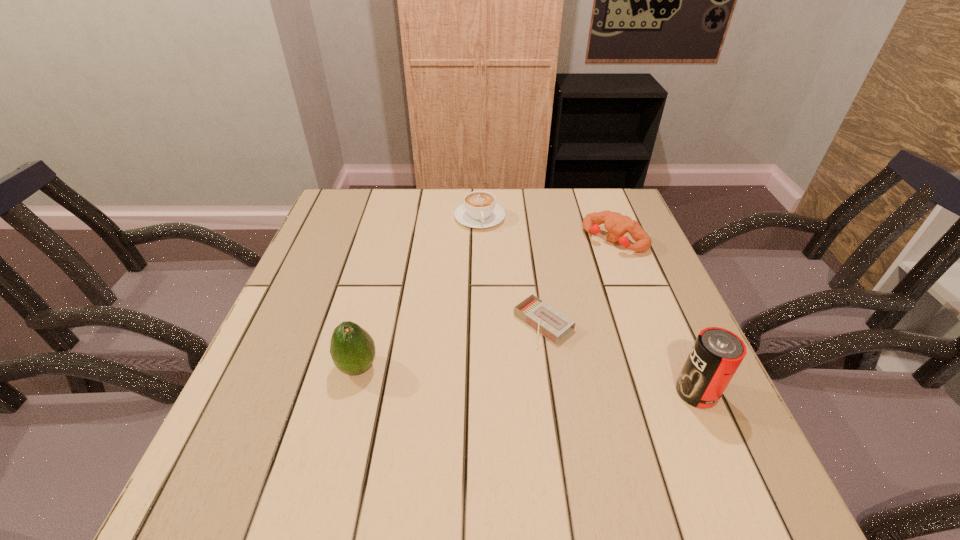
In the image, there is a desktop. At what (x,y) coordinates should I click in order to perform the action: click on free space at the far right corner. Please return your answer as a coordinate pair (x, y). The image size is (960, 540). Looking at the image, I should click on (619, 201).

You are a GUI agent. You are given a task and a screenshot of the screen. Output one action in this format:
    pyautogui.click(x=<x>, y=<y>)
    Task: Click on the vacant region at the near right corner
    
    Given the screenshot: What is the action you would take?
    pyautogui.click(x=663, y=417)

At what (x,y) coordinates should I click in order to perform the action: click on blank region between the can and the third shortest object. Please return your answer as a coordinate pair (x, y). Looking at the image, I should click on (656, 316).

The image size is (960, 540). What are the coordinates of `free space between the fourth tallest object and the puncher` in the screenshot? It's located at (547, 229).

You are a GUI agent. You are given a task and a screenshot of the screen. Output one action in this format:
    pyautogui.click(x=<x>, y=<y>)
    Task: Click on the vacant area between the puncher and the tallest object
    
    Given the screenshot: What is the action you would take?
    pos(656,316)

At what (x,y) coordinates should I click in order to perform the action: click on free spot between the can and the avocado. Please return your answer as a coordinate pair (x, y). The width and height of the screenshot is (960, 540). Looking at the image, I should click on (527, 380).

Identify the location of vacant area that lies between the leftmost object and the tallest object. (527, 380).

This screenshot has width=960, height=540. What are the coordinates of `free space that is in between the cappuccino and the fourth shortest object` in the screenshot? It's located at (419, 292).

Find the location of `free area in between the matchbox and the avocado`. free area in between the matchbox and the avocado is located at coordinates (450, 346).

Where is `vacant point located between the third shortest object and the leftmost object`? The image size is (960, 540). vacant point located between the third shortest object and the leftmost object is located at coordinates (486, 303).